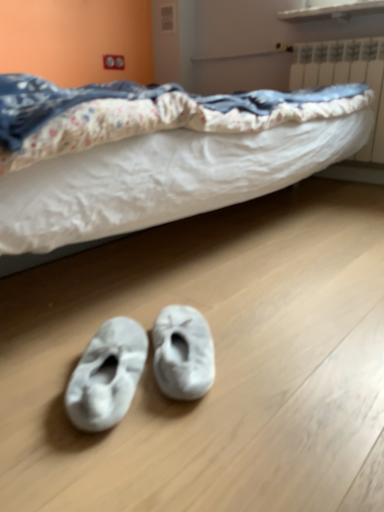
Identify the location of free space in front of white fuzzy slippers at lower center, the 1th footwear positioned from the left. The height and width of the screenshot is (512, 384). (102, 463).